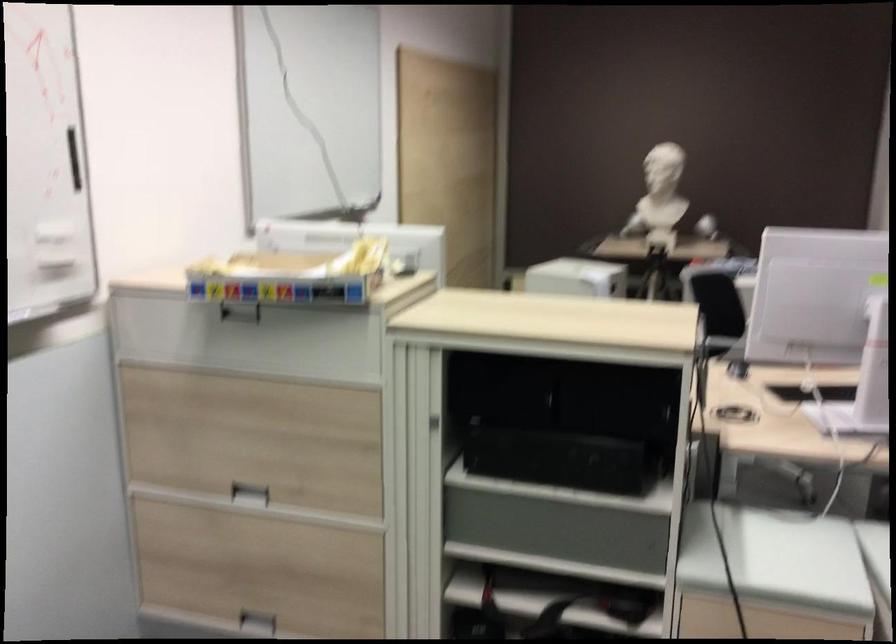
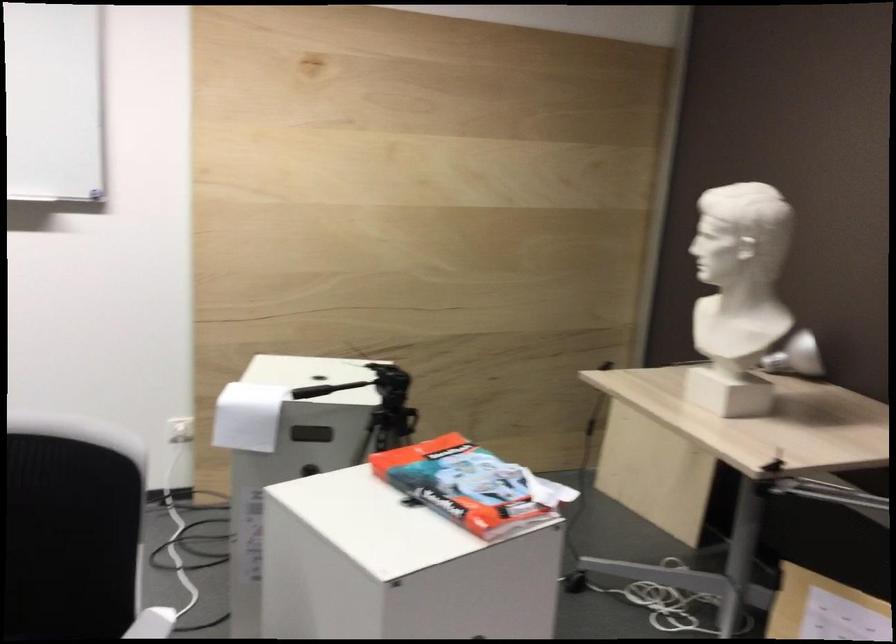
Find the pixel in the second image that matches pixel 682 174 in the first image.

(746, 281)